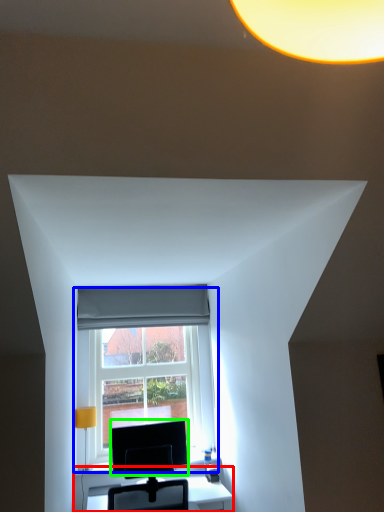
Question: Which object is the farthest from table (highlighted by a red box)? Choose among these: window (highlighted by a blue box) or computer monitor (highlighted by a green box).

Choices:
 (A) window
 (B) computer monitor

Answer: (A)